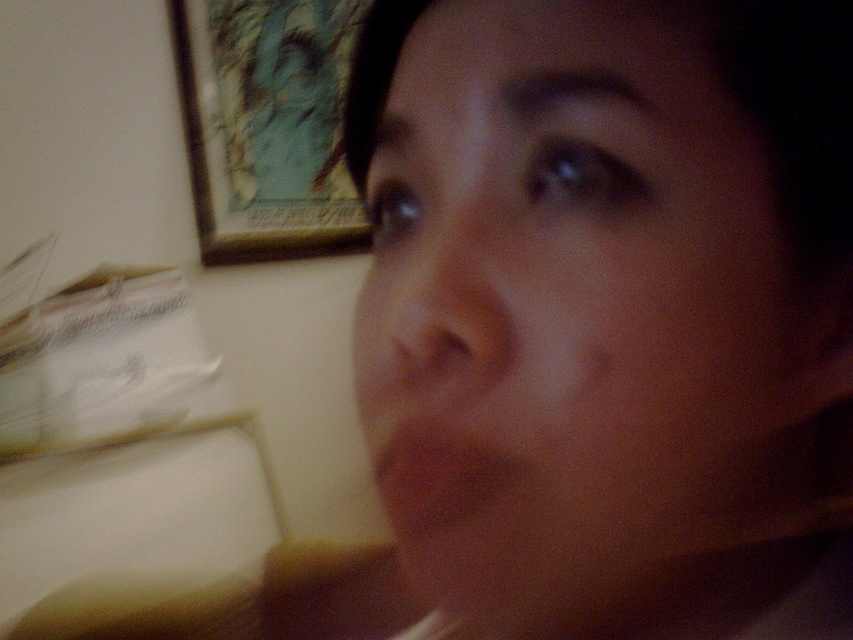
Question: Does smooth skin face at center come in front of smooth skin at center?

Choices:
 (A) yes
 (B) no

Answer: (A)

Question: Which object appears closest to the camera in this image?

Choices:
 (A) smooth skin at center
 (B) wooden framed artwork at upper left
 (C) smooth skin face at center

Answer: (C)

Question: Does wooden framed artwork at upper left have a smaller size compared to smooth skin at center?

Choices:
 (A) yes
 (B) no

Answer: (B)

Question: Which point appears closest to the camera in this image?

Choices:
 (A) [x=305, y=93]
 (B) [x=422, y=307]
 (C) [x=445, y=461]

Answer: (B)

Question: Does wooden framed artwork at upper left appear under smooth skin at center?

Choices:
 (A) no
 (B) yes

Answer: (A)

Question: Which object is positioned farthest from the smooth skin at center?

Choices:
 (A) smooth skin face at center
 (B) wooden framed artwork at upper left

Answer: (B)